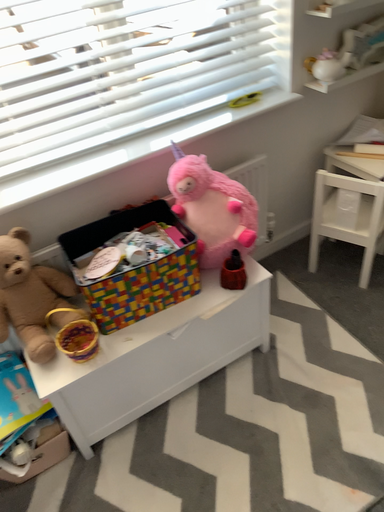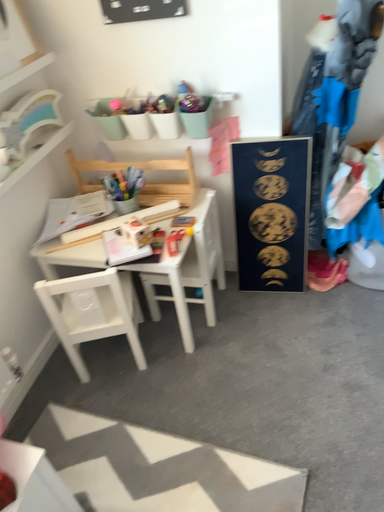
Question: Which way did the camera rotate in the video?

Choices:
 (A) rotated right
 (B) rotated left

Answer: (A)